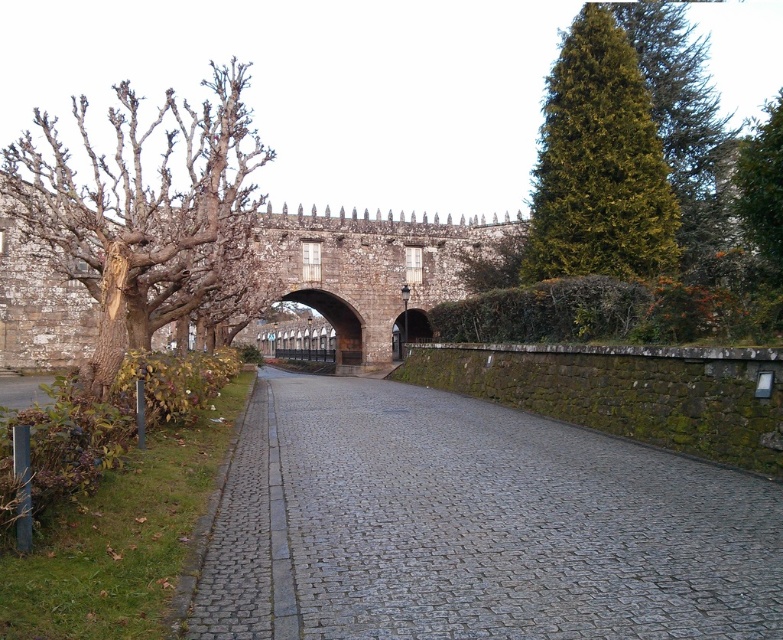
In the scene shown: You are standing at the starting point of the cobblestone pathway in the historic scene. You see two points marked on the path. The first point is at coordinates point (141, 179) and the second point is at coordinates point (590, 228). If you walk straight along the pathway towards the arched gateway, which point will you encounter first?

Point (141, 179) will be encountered first because it is positioned behind point (590, 228), meaning it is closer to the starting point of the pathway.

You are a tour guide explaining the castle grounds to visitors. Pointing to the gray cobblestone pavement at center and the green textured tree at upper right, you want to highlight their spatial relationship. Which object is wider in this scene?

The gray cobblestone pavement at center is wider than the green textured tree at upper right.

You are a tourist standing at the entrance of the castle grounds. You see the gray cobblestone pavement at center and the green leafy tree at upper right. Which object appears smaller in the image?

The gray cobblestone pavement at center appears smaller compared to the green leafy tree at upper right.